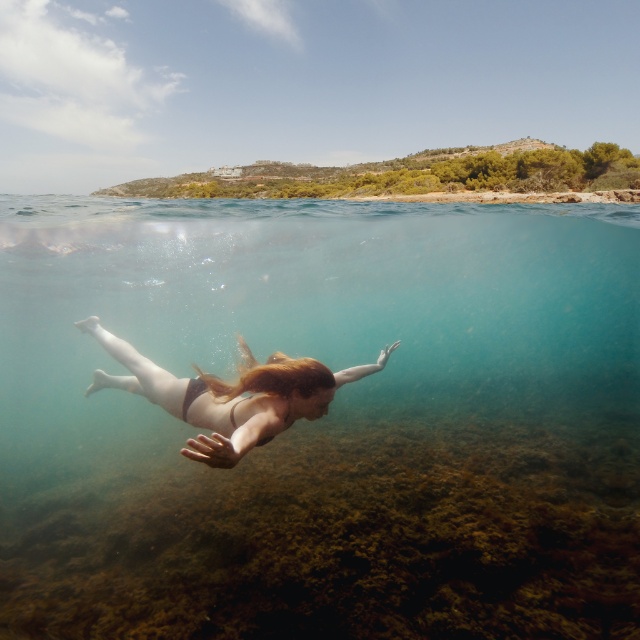
Question: Is the position of clear blue water at center less distant than that of smooth skin girl at center?

Choices:
 (A) yes
 (B) no

Answer: (B)

Question: Can you confirm if clear blue water at center is thinner than smooth skin girl at center?

Choices:
 (A) yes
 (B) no

Answer: (B)

Question: Which object is positioned closest to the blonde silky hair at center?

Choices:
 (A) smooth skin girl at center
 (B) clear blue water at center

Answer: (A)

Question: Based on their relative distances, which object is farther from the blonde silky hair at center?

Choices:
 (A) smooth skin girl at center
 (B) clear blue water at center

Answer: (B)

Question: Which of the following is the closest to the observer?

Choices:
 (A) (260, 420)
 (B) (218, 388)

Answer: (A)

Question: Does clear blue water at center appear over blonde silky hair at center?

Choices:
 (A) yes
 (B) no

Answer: (B)